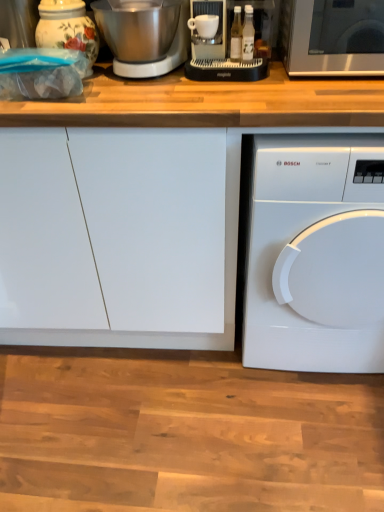
The image size is (384, 512). In order to click on vacant region in front of matte black coffee machine at upper center in this screenshot , I will do pos(241,92).